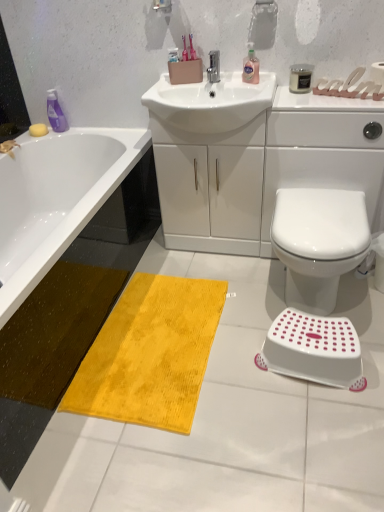
Question: Considering their positions, is satin black candle at upper right located in front of or behind purple plastic bottle at upper left, arranged as the second cleaning product when viewed from the right?

Choices:
 (A) behind
 (B) front

Answer: (B)

Question: From a real-world perspective, is satin black candle at upper right positioned above or below purple plastic bottle at upper left, arranged as the second cleaning product when viewed from the right?

Choices:
 (A) above
 (B) below

Answer: (A)

Question: Which of these objects is positioned closest to the yellow plush mat at lower left?

Choices:
 (A) satin black candle at upper right
 (B) silver metallic faucet at center
 (C) white plastic step stool at lower right
 (D) white glossy sink at center
 (E) yellow sponge at upper left

Answer: (D)

Question: Which object is the farthest from the yellow plush mat at lower left?

Choices:
 (A) purple plastic bottle at upper left, arranged as the second cleaning product when viewed from the right
 (B) pink translucent liquid at upper center, which is the 1th cleaning product in right-to-left order
 (C) yellow sponge at upper left
 (D) white glossy sink at center
 (E) yellow plush bath mat at center

Answer: (B)